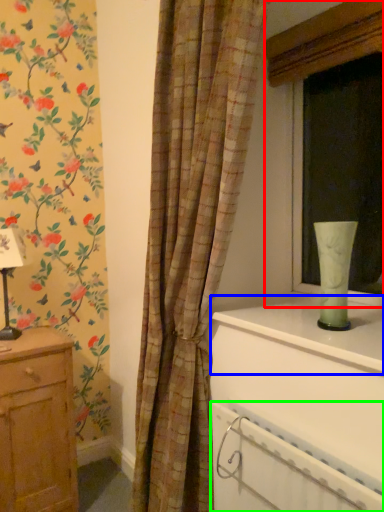
Question: Considering the real-world distances, which object is closest to window (highlighted by a red box)? window sill (highlighted by a blue box) or radiator (highlighted by a green box).

Choices:
 (A) window sill
 (B) radiator

Answer: (A)